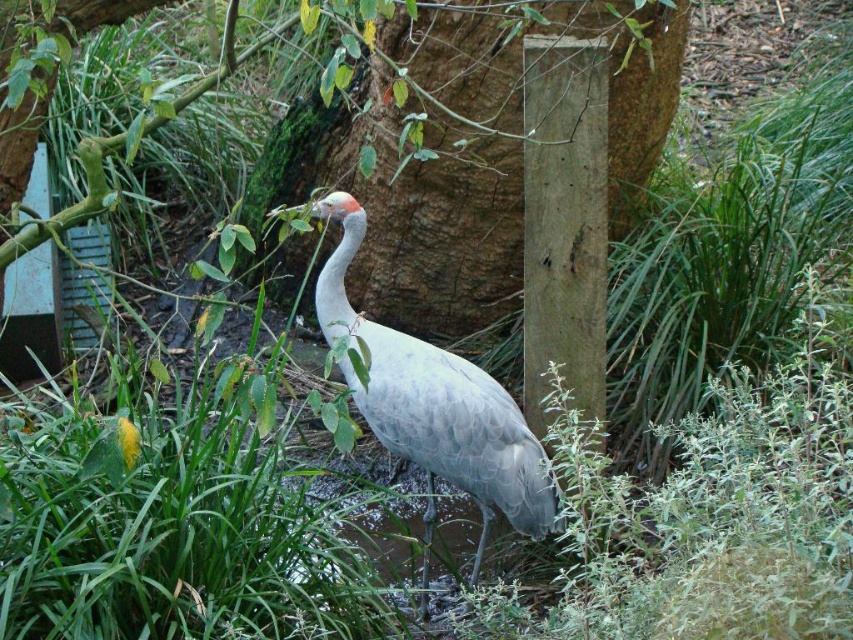
Question: Is brown rough tree trunk at center positioned behind gray matte bird at center?

Choices:
 (A) yes
 (B) no

Answer: (A)

Question: Is brown rough tree trunk at center above gray matte bird at center?

Choices:
 (A) yes
 (B) no

Answer: (A)

Question: Which of the following is the farthest from the observer?

Choices:
 (A) gray matte bird at center
 (B) brown rough tree trunk at center

Answer: (B)

Question: Is brown rough tree trunk at center wider than gray matte bird at center?

Choices:
 (A) yes
 (B) no

Answer: (A)

Question: Among these points, which one is nearest to the camera?

Choices:
 (A) (492, 417)
 (B) (328, 246)

Answer: (A)